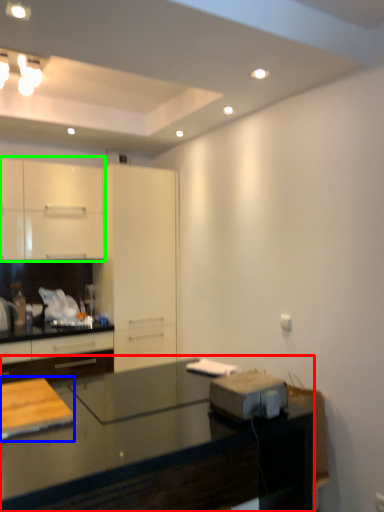
Question: Which object is the farthest from countertop (highlighted by a red box)? Choose among these: table (highlighted by a blue box) or cabinetry (highlighted by a green box).

Choices:
 (A) table
 (B) cabinetry

Answer: (B)